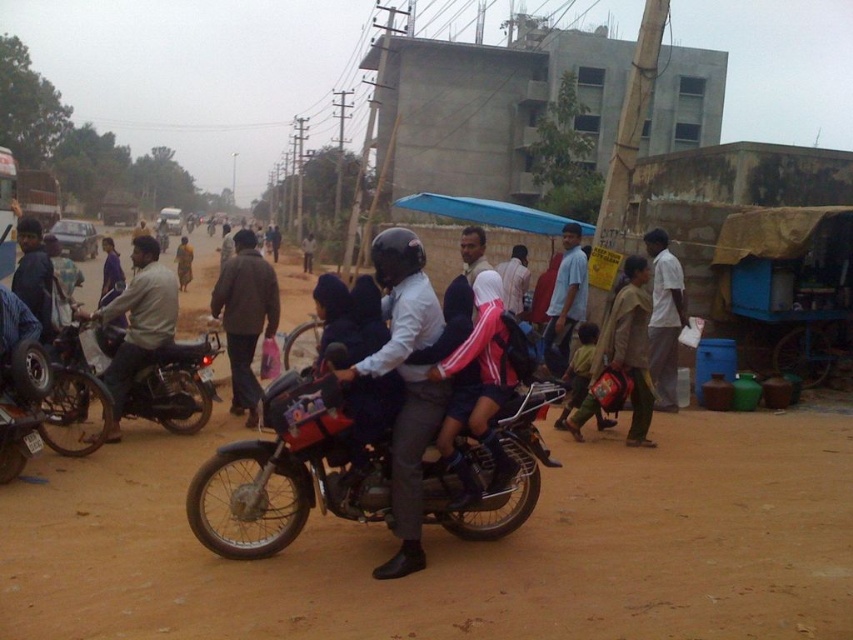
Question: Can you confirm if brown dirt field at center is smaller than metallic silver motorcycle at center?

Choices:
 (A) no
 (B) yes

Answer: (A)

Question: Among these objects, which one is nearest to the camera?

Choices:
 (A) brushed metal motorcycle at center
 (B) light beige shirt at center
 (C) metallic silver motorcycle at center
 (D) brown fabric jacket at center

Answer: (A)

Question: Is brown dirt field at center behind red matte motorcycle at center?

Choices:
 (A) yes
 (B) no

Answer: (B)

Question: Considering the real-world distances, which object is farthest from the brown dirt field at center?

Choices:
 (A) metallic silver motorcycle at center
 (B) red matte motorcycle at center
 (C) light beige shirt at center
 (D) white cotton shirt at center

Answer: (C)

Question: Considering the real-world distances, which object is closest to the light beige shirt at center?

Choices:
 (A) matte black helmet at center
 (B) brown fabric jacket at center

Answer: (B)

Question: Does matte black helmet at center have a larger size compared to brushed metal motorcycle at center?

Choices:
 (A) yes
 (B) no

Answer: (B)